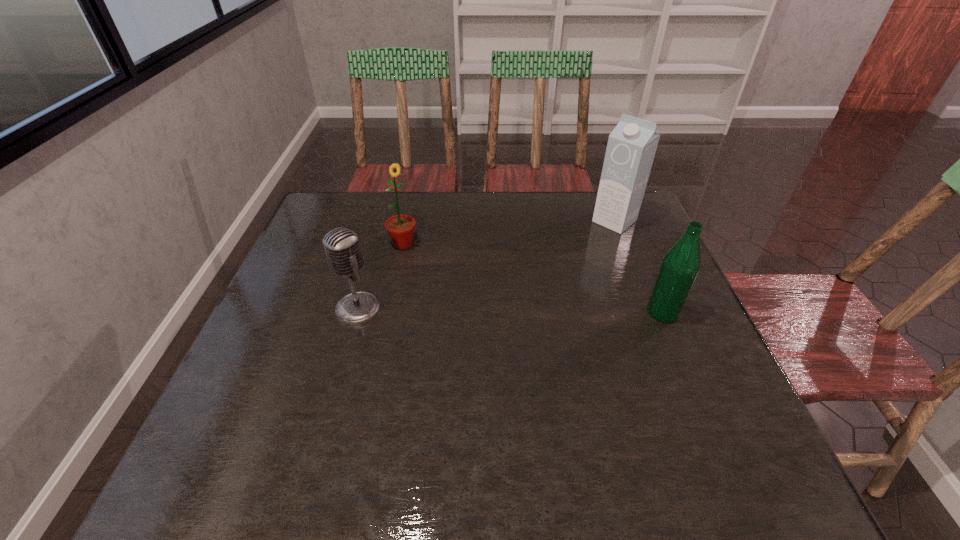
Identify the location of vacant space at the far left corner of the desktop. (359, 207).

Find the location of a particular element. The image size is (960, 540). vacant area between the bottle and the carton is located at coordinates (x=638, y=267).

You are a GUI agent. You are given a task and a screenshot of the screen. Output one action in this format:
    pyautogui.click(x=<x>, y=<y>)
    Task: Click on the vacant space in between the microphone and the sunflower
    The image size is (960, 540).
    Given the screenshot: What is the action you would take?
    pyautogui.click(x=381, y=276)

At what (x,y) coordinates should I click in order to perform the action: click on free space between the bottle and the microphone. Please return your answer as a coordinate pair (x, y). This screenshot has width=960, height=540. Looking at the image, I should click on (511, 311).

Locate an element on the screen. unoccupied position between the third nearest object and the carton is located at coordinates (509, 232).

Identify the location of free space that is in between the second farthest object and the farthest object. (509, 232).

This screenshot has width=960, height=540. I want to click on free space that is in between the third nearest object and the microphone, so click(x=381, y=276).

Where is `free area in between the sunflower and the microphone`? The height and width of the screenshot is (540, 960). free area in between the sunflower and the microphone is located at coordinates (381, 276).

Locate an element on the screen. vacant region between the third nearest object and the microphone is located at coordinates point(381,276).

This screenshot has width=960, height=540. In order to click on free space between the tallest object and the microphone in this screenshot , I will do `click(487, 265)`.